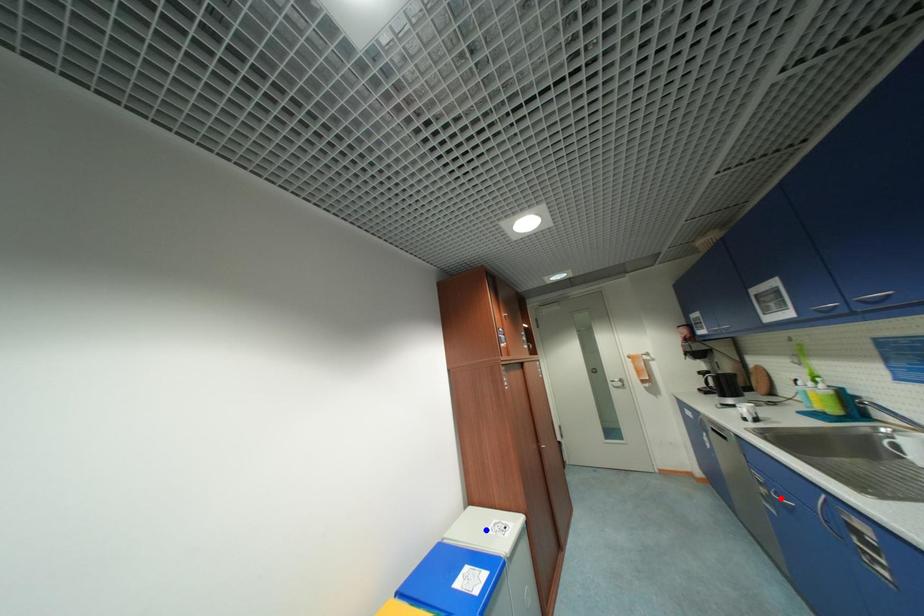
Question: In the image, two points are highlighted. Which point is nearer to the camera? Reply with the corresponding letter.

Choices:
 (A) blue point
 (B) red point

Answer: (B)